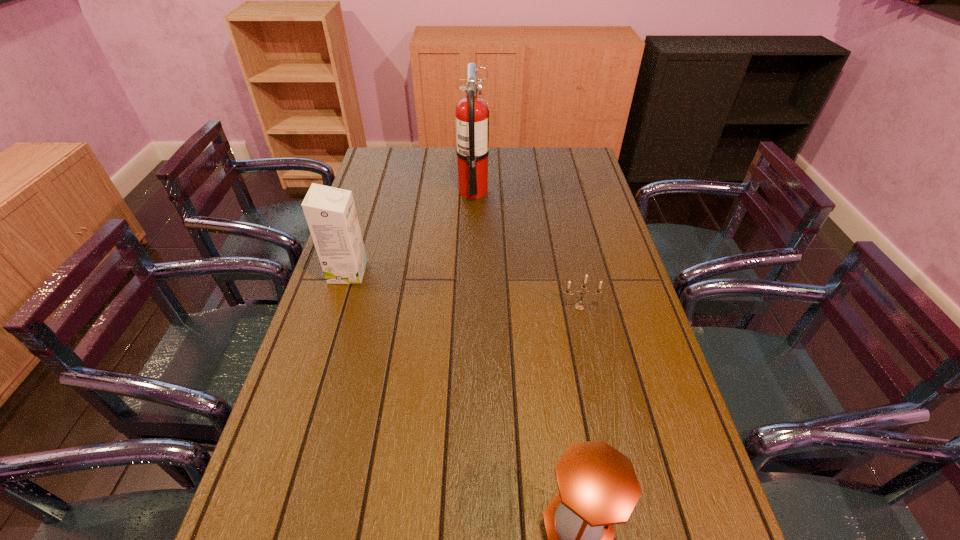
You are a GUI agent. You are given a task and a screenshot of the screen. Output one action in this format:
    pyautogui.click(x=<x>, y=<y>)
    Task: Click on the object that is at the left edge
    The image size is (960, 540).
    Given the screenshot: What is the action you would take?
    pyautogui.click(x=330, y=212)

Where is `object that is positioned at the right edge`? Image resolution: width=960 pixels, height=540 pixels. object that is positioned at the right edge is located at coordinates (579, 306).

The width and height of the screenshot is (960, 540). I want to click on vacant space at the far edge of the desktop, so click(501, 154).

In the image, there is a desktop. Identify the location of free space at the left edge. [354, 352].

In the image, there is a desktop. In order to click on vacant space at the right edge in this screenshot , I will do `click(666, 521)`.

You are a GUI agent. You are given a task and a screenshot of the screen. Output one action in this format:
    pyautogui.click(x=<x>, y=<y>)
    Task: Click on the vacant space at the far right corner of the desktop
    The width and height of the screenshot is (960, 540).
    Given the screenshot: What is the action you would take?
    click(x=574, y=152)

Locate an element on the screen. free space between the tallest object and the carton is located at coordinates (411, 231).

Where is `free space between the third farthest object and the second farthest object`? This screenshot has width=960, height=540. free space between the third farthest object and the second farthest object is located at coordinates (464, 289).

What are the coordinates of `empty space between the leftmost object and the candle` in the screenshot? It's located at (x=464, y=289).

Locate an element on the screen. This screenshot has width=960, height=540. empty space that is in between the shortest object and the tallest object is located at coordinates (526, 249).